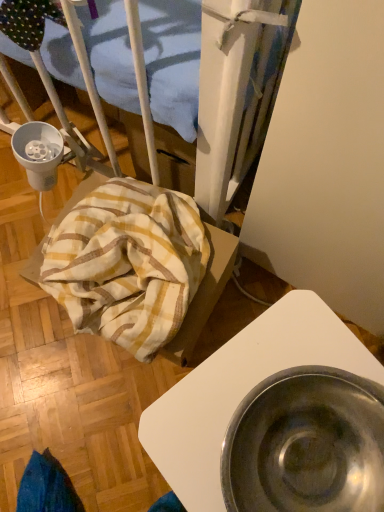
In order to face metallic silver bowl at lower right, should I rotate leftwards or rightwards?

You should rotate right by 9.335 degrees.

This screenshot has width=384, height=512. What do you see at coordinates (241, 390) in the screenshot?
I see `metallic silver bowl at lower right` at bounding box center [241, 390].

This screenshot has width=384, height=512. Identify the location of metallic silver bowl at lower right. (241, 390).

This screenshot has height=512, width=384. Identify the location of yellow-white striped fabric at lower left. (127, 263).

What do you see at coordinates (127, 263) in the screenshot? This screenshot has width=384, height=512. I see `yellow-white striped fabric at lower left` at bounding box center [127, 263].

What are the coordinates of `metallic silver bowl at lower right` in the screenshot? It's located at (241, 390).

Is yellow-white striped fabric at lower left to the left of metallic silver bowl at lower right from the viewer's perspective?

Indeed, yellow-white striped fabric at lower left is positioned on the left side of metallic silver bowl at lower right.

Is yellow-white striped fabric at lower left in front of metallic silver bowl at lower right?

That is False.

Which point is more forward, [185,252] or [187,495]?

Point [187,495]

From the image's perspective, which is above, yellow-white striped fabric at lower left or metallic silver bowl at lower right?

yellow-white striped fabric at lower left.

From a real-world perspective, does yellow-white striped fabric at lower left stand above metallic silver bowl at lower right?

No, from a real-world perspective, yellow-white striped fabric at lower left is not above metallic silver bowl at lower right.

In terms of width, does yellow-white striped fabric at lower left look wider or thinner when compared to metallic silver bowl at lower right?

Considering their sizes, yellow-white striped fabric at lower left looks slimmer than metallic silver bowl at lower right.

Considering the relative sizes of yellow-white striped fabric at lower left and metallic silver bowl at lower right in the image provided, is yellow-white striped fabric at lower left shorter than metallic silver bowl at lower right?

Yes.

Does yellow-white striped fabric at lower left have a larger size compared to metallic silver bowl at lower right?

Actually, yellow-white striped fabric at lower left might be smaller than metallic silver bowl at lower right.

Is metallic silver bowl at lower right located within yellow-white striped fabric at lower left?

No, metallic silver bowl at lower right is not surrounded by yellow-white striped fabric at lower left.

Is yellow-white striped fabric at lower left placed right next to metallic silver bowl at lower right?

There is a gap between yellow-white striped fabric at lower left and metallic silver bowl at lower right.

Is yellow-white striped fabric at lower left looking in the opposite direction of metallic silver bowl at lower right?

yellow-white striped fabric at lower left is not turned away from metallic silver bowl at lower right.

Measure the distance from yellow-white striped fabric at lower left to metallic silver bowl at lower right.

9.89 inches.

Locate an element on the screen. This screenshot has width=384, height=512. blanket that appears behind the metallic silver bowl at lower right is located at coordinates (127, 263).

Which is more to the right, metallic silver bowl at lower right or yellow-white striped fabric at lower left?

metallic silver bowl at lower right is more to the right.

Between metallic silver bowl at lower right and yellow-white striped fabric at lower left, which one is positioned behind?

yellow-white striped fabric at lower left is behind.

Between point (146, 438) and point (156, 312), which one is positioned in front?

The point (146, 438) is more forward.

From the image's perspective, between metallic silver bowl at lower right and yellow-white striped fabric at lower left, who is located below?

metallic silver bowl at lower right appears lower in the image.

From a real-world perspective, between metallic silver bowl at lower right and yellow-white striped fabric at lower left, who is vertically higher?

metallic silver bowl at lower right is physically above.

Considering the relative sizes of metallic silver bowl at lower right and yellow-white striped fabric at lower left in the image provided, is metallic silver bowl at lower right wider than yellow-white striped fabric at lower left?

Yes, metallic silver bowl at lower right is wider than yellow-white striped fabric at lower left.

Between metallic silver bowl at lower right and yellow-white striped fabric at lower left, which one has more height?

metallic silver bowl at lower right is taller.

Considering the sizes of objects metallic silver bowl at lower right and yellow-white striped fabric at lower left in the image provided, who is bigger, metallic silver bowl at lower right or yellow-white striped fabric at lower left?

Bigger between the two is metallic silver bowl at lower right.

Is metallic silver bowl at lower right not inside yellow-white striped fabric at lower left?

Yes, metallic silver bowl at lower right is located beyond the bounds of yellow-white striped fabric at lower left.

Would you say metallic silver bowl at lower right is a long distance from yellow-white striped fabric at lower left?

metallic silver bowl at lower right is near yellow-white striped fabric at lower left, not far away.

Is metallic silver bowl at lower right facing towards yellow-white striped fabric at lower left?

No, metallic silver bowl at lower right does not turn towards yellow-white striped fabric at lower left.

How many degrees apart are the facing directions of metallic silver bowl at lower right and yellow-white striped fabric at lower left?

They differ by 27 degrees in their facing directions.

How much distance is there between metallic silver bowl at lower right and yellow-white striped fabric at lower left?

9.89 inches.

Locate an element on the screen. The width and height of the screenshot is (384, 512). furniture above the yellow-white striped fabric at lower left (from a real-world perspective) is located at coordinates (x=241, y=390).

At what (x,y) coordinates should I click in order to perform the action: click on furniture that is on the right side of yellow-white striped fabric at lower left. Please return your answer as a coordinate pair (x, y). This screenshot has height=512, width=384. Looking at the image, I should click on (241, 390).

What are the coordinates of `blanket lying behind the metallic silver bowl at lower right` in the screenshot? It's located at (127, 263).